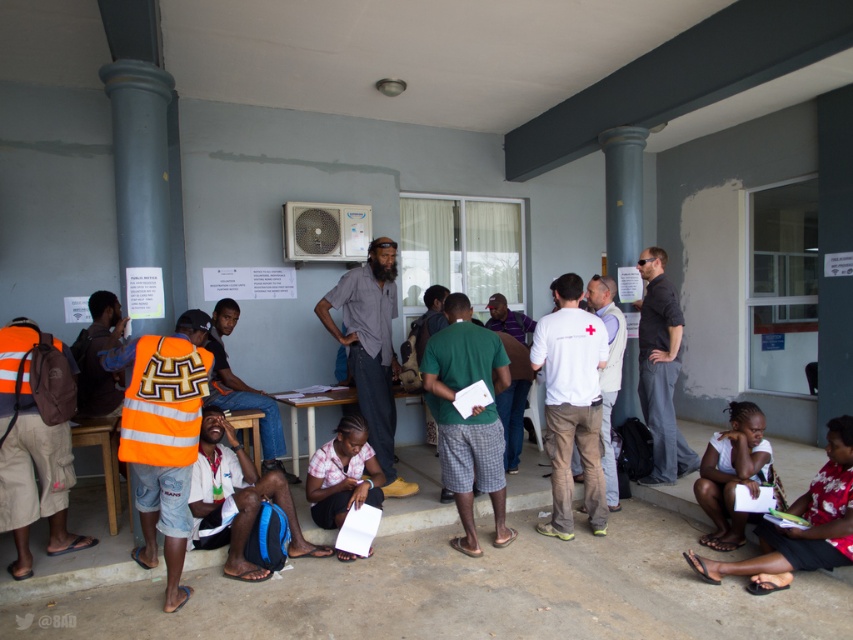
You are a photographer trying to capture a photo that includes both the gray cotton shirt at center and the pink fabric shirt at lower center. Which of the two shirts should you focus on first to ensure both are in the frame?

The gray cotton shirt at center is further to the viewer than the pink fabric shirt at lower center, so you should focus on the gray cotton shirt at center first to ensure both are in the frame.

You are organizing a photo shoot and need to arrange two models wearing the gray cotton shirt at center and the pink fabric shirt at lower center. If you want to emphasize the size difference between them, where should you position each model relative to the camera?

To emphasize the size difference between the gray cotton shirt at center and the pink fabric shirt at lower center, position the gray cotton shirt at center closer to the camera and the pink fabric shirt at lower center further away. This arrangement will make the larger gray cotton shirt appear even bigger and the smaller pink fabric shirt appear smaller in comparison.